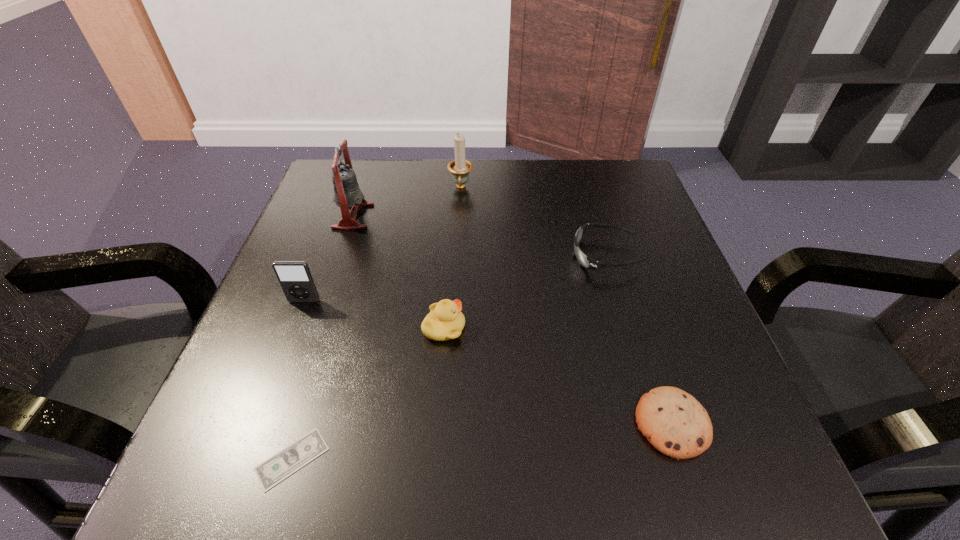
Image resolution: width=960 pixels, height=540 pixels. Find the location of `vacant area between the tallest object and the sixth tallest object`. vacant area between the tallest object and the sixth tallest object is located at coordinates (513, 320).

Select which object appears as the third closest to the shortest object. Please provide its 2D coordinates. Your answer should be formatted as a tuple, i.e. [(x, y)], where the tuple contains the x and y coordinates of a point satisfying the conditions above.

[(674, 422)]

Identify which object is the sixth closest to the bell. Please provide its 2D coordinates. Your answer should be formatted as a tuple, i.e. [(x, y)], where the tuple contains the x and y coordinates of a point satisfying the conditions above.

[(674, 422)]

Where is `vacant space that satisfies the following two spatial constraints: 1. on the handle side of the sixth shortest object; 2. on the beak of the duckling`? vacant space that satisfies the following two spatial constraints: 1. on the handle side of the sixth shortest object; 2. on the beak of the duckling is located at coordinates (453, 328).

Identify the location of vacant region that satisfies the following two spatial constraints: 1. on the handle side of the sixth shortest object; 2. on the beak of the third nearest object. (453, 328).

The height and width of the screenshot is (540, 960). I want to click on free region that satisfies the following two spatial constraints: 1. on the handle side of the sixth shortest object; 2. on the beak of the fourth tallest object, so click(453, 328).

Identify the location of free region that satisfies the following two spatial constraints: 1. on the beak of the sixth tallest object; 2. on the left side of the fourth tallest object. This screenshot has height=540, width=960. (437, 423).